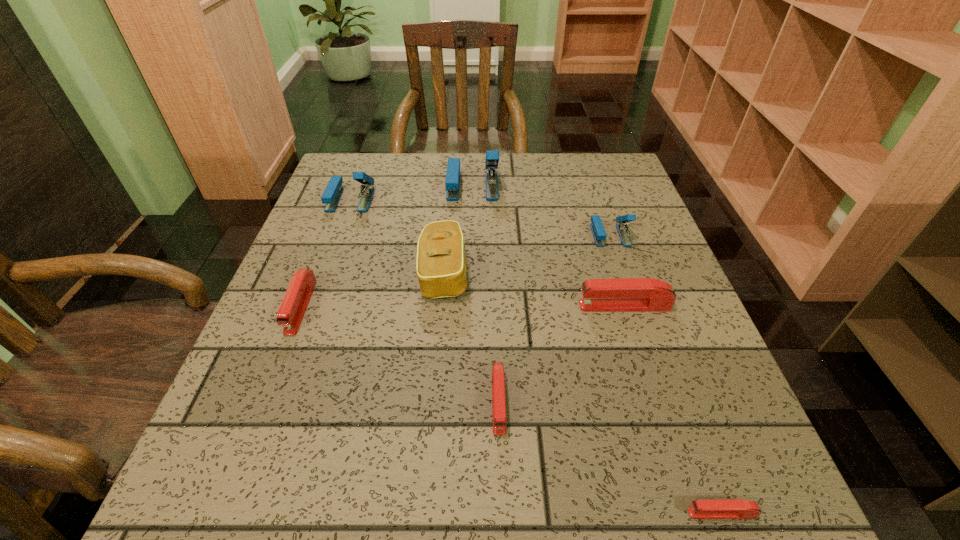
Locate an element on the screen. vacant region located 0.330m on the front-facing side of the biggest red stapler is located at coordinates 413,306.

At what (x,y) coordinates should I click in order to perform the action: click on vacant space located on the front-facing side of the fifth tallest stapler. Please return your answer as a coordinate pair (x, y). The height and width of the screenshot is (540, 960). Looking at the image, I should click on (250, 438).

At what (x,y) coordinates should I click in order to perform the action: click on free space located 0.100m on the front-facing side of the second nearest object. Please return your answer as a coordinate pair (x, y). Looking at the image, I should click on (502, 504).

At what (x,y) coordinates should I click in order to perform the action: click on vacant space located on the front-facing side of the smallest red stapler. Please return your answer as a coordinate pair (x, y). Looking at the image, I should click on (579, 513).

I want to click on free space located 0.220m on the front-facing side of the smallest red stapler, so click(527, 513).

You are a GUI agent. You are given a task and a screenshot of the screen. Output one action in this format:
    pyautogui.click(x=<x>, y=<y>)
    Task: Click on the vacant region located 0.380m on the front-facing side of the smallest red stapler
    This screenshot has height=540, width=960.
    Given the screenshot: What is the action you would take?
    pyautogui.click(x=410, y=513)

Identify the location of object that is positioned at the near edge. (734, 508).

Image resolution: width=960 pixels, height=540 pixels. Identify the location of object that is at the far left corner. (332, 193).

At what (x,y) coordinates should I click in order to perform the action: click on object situated at the near right corner. Please return your answer as a coordinate pair (x, y). Looking at the image, I should click on tap(734, 508).

Find the location of a particular element. The height and width of the screenshot is (540, 960). blank area at the far edge is located at coordinates (399, 192).